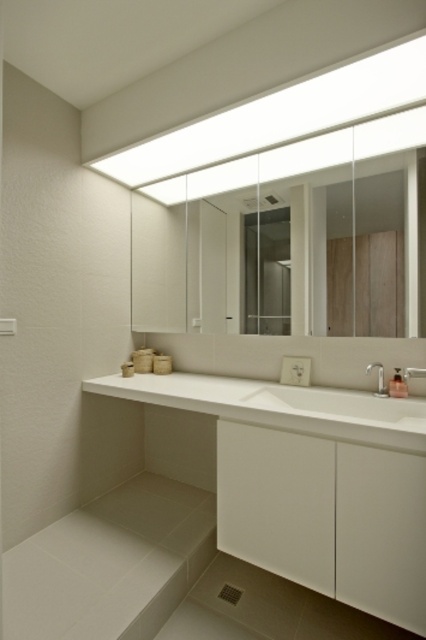
Can you confirm if transparent glass mirror at upper center is bigger than satin nickel faucet at sink right?

Yes, transparent glass mirror at upper center is bigger than satin nickel faucet at sink right.

Is point (201, 280) behind point (411, 368)?

Yes, point (201, 280) is farther from viewer.

Locate an element on the screen. This screenshot has width=426, height=640. transparent glass mirror at upper center is located at coordinates (282, 237).

Does point (383, 392) lie in front of point (408, 368)?

That is False.

Between satin nickel faucet at right and satin nickel faucet at sink right, which one appears on the left side from the viewer's perspective?

satin nickel faucet at right is more to the left.

Does point (367, 372) lie in front of point (419, 369)?

No.

You are a GUI agent. You are given a task and a screenshot of the screen. Output one action in this format:
    pyautogui.click(x=<x>, y=<y>)
    Task: Click on the satin nickel faucet at right
    The image size is (426, 640).
    Given the screenshot: What is the action you would take?
    pyautogui.click(x=377, y=378)

Can you confirm if white glossy vanity at lower center is bigger than satin nickel faucet at right?

Yes, white glossy vanity at lower center is bigger than satin nickel faucet at right.

You are a GUI agent. You are given a task and a screenshot of the screen. Output one action in this format:
    pyautogui.click(x=<x>, y=<y>)
    Task: Click on the white glossy vanity at lower center
    Image resolution: width=426 pixels, height=640 pixels.
    Given the screenshot: What is the action you would take?
    pyautogui.click(x=313, y=483)